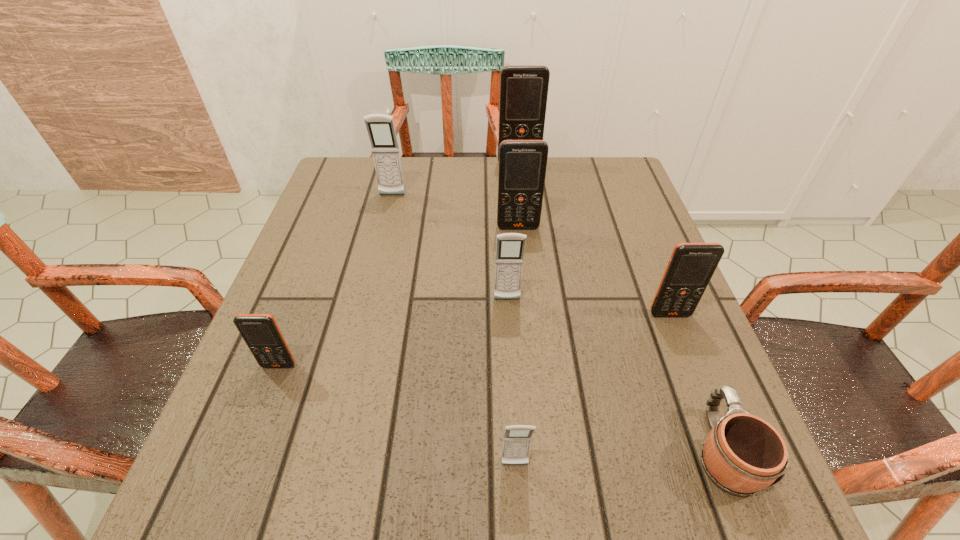
Locate an element on the screen. free space between the fourth nearest object and the mug is located at coordinates (696, 382).

Where is `free space between the mug and the seventh nearest object`? This screenshot has height=540, width=960. free space between the mug and the seventh nearest object is located at coordinates (557, 323).

Find the location of a particular element. The width and height of the screenshot is (960, 540). vacant area that lies between the second cellular telephone from left to right and the smallest gray cellular telephone is located at coordinates (453, 330).

You are a GUI agent. You are given a task and a screenshot of the screen. Output one action in this format:
    pyautogui.click(x=<x>, y=<y>)
    Task: Click on the free spot between the shortest object and the farthest object
    This screenshot has height=540, width=960.
    Given the screenshot: What is the action you would take?
    pyautogui.click(x=621, y=307)

Where is `object that is the second nearest to the biggest orange cellular telephone`? This screenshot has height=540, width=960. object that is the second nearest to the biggest orange cellular telephone is located at coordinates (380, 127).

Identify the location of object that is the third nearest to the mug. This screenshot has width=960, height=540. (510, 247).

Identify which cellular telephone is located as the nearest to the nearest gray cellular telephone. Please provide its 2D coordinates. Your answer should be formatted as a tuple, i.e. [(x, y)], where the tuple contains the x and y coordinates of a point satisfying the conditions above.

[(510, 247)]

Find the location of `cellular telephone that is the sixth nearest to the smallest gray cellular telephone`. cellular telephone that is the sixth nearest to the smallest gray cellular telephone is located at coordinates (523, 88).

Locate an element on the screen. This screenshot has height=540, width=960. orange cellular telephone identified as the second closest to the fifth farthest cellular telephone is located at coordinates (523, 88).

This screenshot has width=960, height=540. Find the location of `the third closest orange cellular telephone to the third nearest orange cellular telephone`. the third closest orange cellular telephone to the third nearest orange cellular telephone is located at coordinates (261, 333).